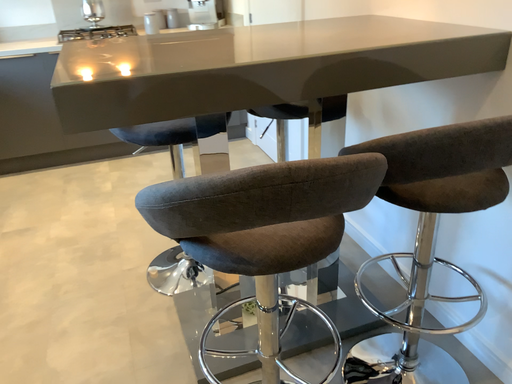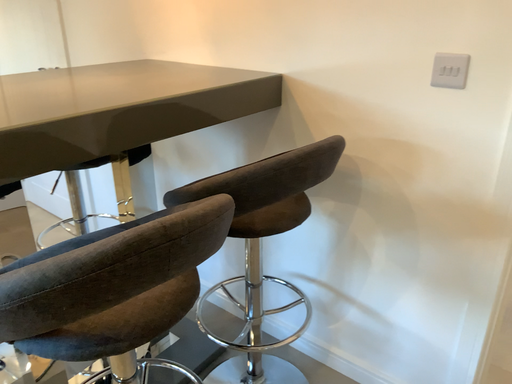
Question: Which way did the camera rotate in the video?

Choices:
 (A) rotated upward
 (B) rotated downward

Answer: (A)